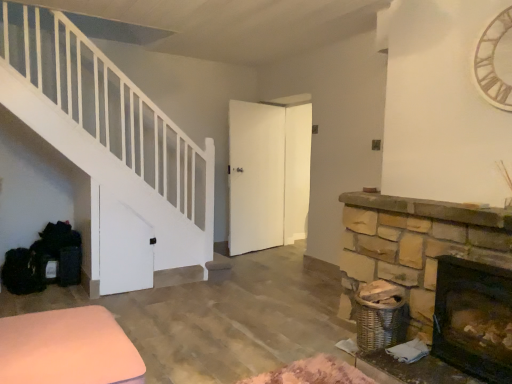
What do you see at coordinates (495, 61) in the screenshot? The width and height of the screenshot is (512, 384). I see `wooden clock at upper right` at bounding box center [495, 61].

In order to face wooden clock at upper right, should I rotate leftwards or rightwards?

A 29.107 degree turn to the right will do.

What is the approximate height of dark brown stone fireplace at lower right?

23.71 inches.

Measure the distance between point (478,292) and camera.

Point (478,292) and camera are 7.83 feet apart from each other.

Where is `pink fabric ottoman at lower left`? The width and height of the screenshot is (512, 384). pink fabric ottoman at lower left is located at coordinates (68, 349).

Would you say dark brown stone fireplace at lower right is to the left or to the right of wooden clock at upper right in the picture?

From the image, it's evident that dark brown stone fireplace at lower right is to the left of wooden clock at upper right.

From the image's perspective, is dark brown stone fireplace at lower right on wooden clock at upper right?

No, from the image's perspective, dark brown stone fireplace at lower right is not above wooden clock at upper right.

Where is `clock behind the dark brown stone fireplace at lower right`? The image size is (512, 384). clock behind the dark brown stone fireplace at lower right is located at coordinates (495, 61).

Does point (453, 286) appear closer or farther from the camera than point (99, 382)?

Point (453, 286) is farther from the camera than point (99, 382).

From the image's perspective, between dark brown stone fireplace at lower right and pink fabric ottoman at lower left, which one is located above?

dark brown stone fireplace at lower right appears higher in the image.

Is dark brown stone fireplace at lower right inside or outside of pink fabric ottoman at lower left?

dark brown stone fireplace at lower right cannot be found inside pink fabric ottoman at lower left.

This screenshot has width=512, height=384. I want to click on furniture directly beneath the dark brown stone fireplace at lower right (from a real-world perspective), so click(68, 349).

Locate an element on the screen. This screenshot has height=384, width=512. clock on the right side of pink fabric ottoman at lower left is located at coordinates (495, 61).

Is point (99, 329) behind point (511, 17)?

No, (99, 329) is in front of (511, 17).

Is pink fabric ottoman at lower left located outside wooden clock at upper right?

Absolutely, pink fabric ottoman at lower left is external to wooden clock at upper right.

Is pink fabric ottoman at lower left wider or thinner than wooden clock at upper right?

In the image, pink fabric ottoman at lower left appears to be wider than wooden clock at upper right.

From the image's perspective, is pink fabric ottoman at lower left beneath dark brown stone fireplace at lower right?

Correct, pink fabric ottoman at lower left appears lower than dark brown stone fireplace at lower right in the image.

Which object is wider, pink fabric ottoman at lower left or dark brown stone fireplace at lower right?

pink fabric ottoman at lower left is wider.

Identify the location of fireplace behind the pink fabric ottoman at lower left. The image size is (512, 384). (474, 318).

Are pink fabric ottoman at lower left and dark brown stone fireplace at lower right located far from each other?

pink fabric ottoman at lower left is positioned a significant distance from dark brown stone fireplace at lower right.

From their relative heights in the image, would you say wooden clock at upper right is taller or shorter than dark brown stone fireplace at lower right?

wooden clock at upper right is taller than dark brown stone fireplace at lower right.

In the scene shown: Considering the sizes of wooden clock at upper right and dark brown stone fireplace at lower right in the image, is wooden clock at upper right bigger or smaller than dark brown stone fireplace at lower right?

Clearly, wooden clock at upper right is smaller in size than dark brown stone fireplace at lower right.

Looking at this image, considering the relative sizes of wooden clock at upper right and dark brown stone fireplace at lower right in the image provided, is wooden clock at upper right thinner than dark brown stone fireplace at lower right?

Yes.

How distant is wooden clock at upper right from pink fabric ottoman at lower left?

The distance of wooden clock at upper right from pink fabric ottoman at lower left is 2.43 meters.

Looking at their sizes, would you say wooden clock at upper right is wider or thinner than pink fabric ottoman at lower left?

Considering their sizes, wooden clock at upper right looks slimmer than pink fabric ottoman at lower left.

Would you say wooden clock at upper right is inside or outside pink fabric ottoman at lower left?

wooden clock at upper right cannot be found inside pink fabric ottoman at lower left.

In the scene shown: Considering the sizes of objects wooden clock at upper right and pink fabric ottoman at lower left in the image provided, who is shorter, wooden clock at upper right or pink fabric ottoman at lower left?

pink fabric ottoman at lower left is shorter.

Image resolution: width=512 pixels, height=384 pixels. Find the location of `clock above the dark brown stone fireplace at lower right (from a real-world perspective)`. clock above the dark brown stone fireplace at lower right (from a real-world perspective) is located at coordinates pos(495,61).

Find the location of `fireplace lying on the right of pink fabric ottoman at lower left`. fireplace lying on the right of pink fabric ottoman at lower left is located at coordinates (474, 318).

When comparing their distances from dark brown stone fireplace at lower right, does wooden clock at upper right or pink fabric ottoman at lower left seem closer?

Among the two, wooden clock at upper right is located nearer to dark brown stone fireplace at lower right.

Looking at the image, which one is located closer to wooden clock at upper right, dark brown stone fireplace at lower right or pink fabric ottoman at lower left?

Among the two, dark brown stone fireplace at lower right is located nearer to wooden clock at upper right.

Which object lies further to the anchor point dark brown stone fireplace at lower right, pink fabric ottoman at lower left or wooden clock at upper right?

pink fabric ottoman at lower left.

Considering their positions, is pink fabric ottoman at lower left positioned further to wooden clock at upper right than dark brown stone fireplace at lower right?

Result: pink fabric ottoman at lower left is further to wooden clock at upper right.

From the image, which object appears to be farther from pink fabric ottoman at lower left, wooden clock at upper right or dark brown stone fireplace at lower right?

Based on the image, wooden clock at upper right appears to be further to pink fabric ottoman at lower left.

Estimate the real-world distances between objects in this image. Which object is further from pink fabric ottoman at lower left, dark brown stone fireplace at lower right or wooden clock at upper right?

wooden clock at upper right is further to pink fabric ottoman at lower left.

You are a GUI agent. You are given a task and a screenshot of the screen. Output one action in this format:
    pyautogui.click(x=<x>, y=<y>)
    Task: Click on the fireplace located between pink fabric ottoman at lower left and wooden clock at upper right in the left-right direction
    This screenshot has height=384, width=512.
    Given the screenshot: What is the action you would take?
    pyautogui.click(x=474, y=318)